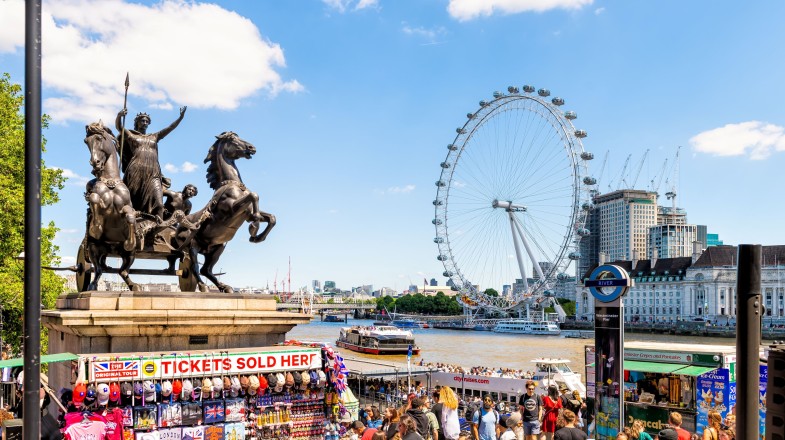
In order to click on booth in this screenshot , I will do `click(676, 361)`, `click(224, 358)`.